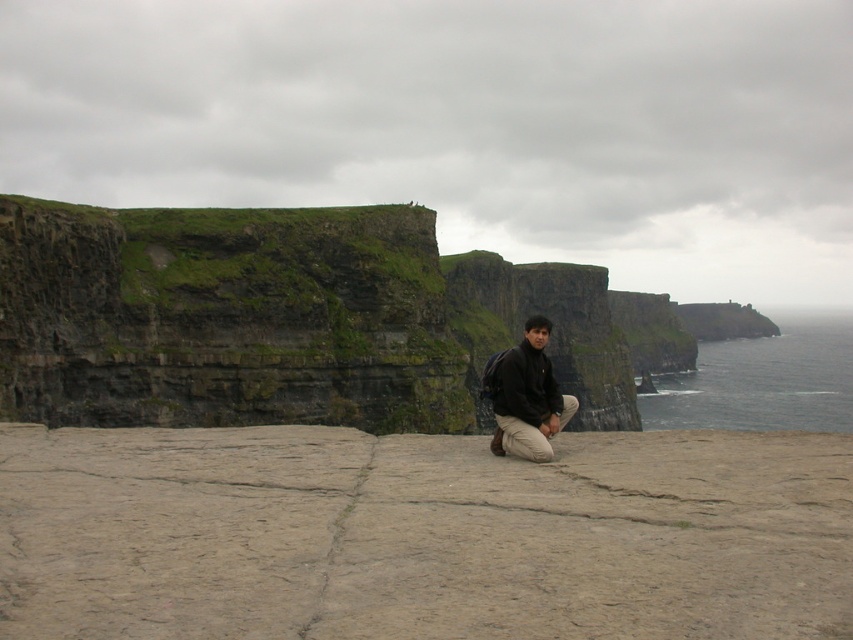
Does brown stone at center appear under dark brown leather jacket at center?

Yes, brown stone at center is below dark brown leather jacket at center.

Between brown stone at center and dark brown leather jacket at center, which one is positioned lower?

brown stone at center

This screenshot has height=640, width=853. What do you see at coordinates (421, 536) in the screenshot? I see `brown stone at center` at bounding box center [421, 536].

At what (x,y) coordinates should I click in order to perform the action: click on brown stone at center. Please return your answer as a coordinate pair (x, y). Looking at the image, I should click on (421, 536).